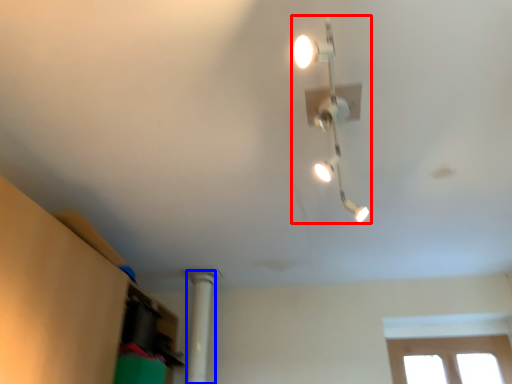
Question: Which of the following is the closest to the observer, lamp (highlighted by a red box) or pillar (highlighted by a blue box)?

Choices:
 (A) lamp
 (B) pillar

Answer: (A)